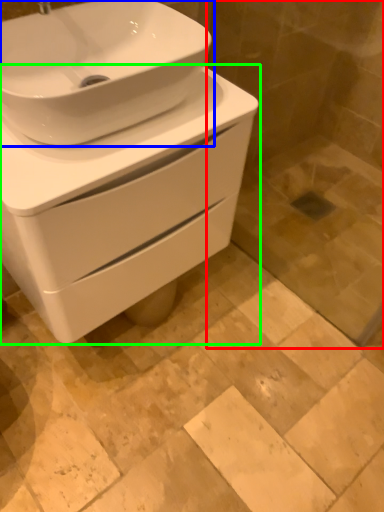
Question: Which object is the closest to the glass door (highlighted by a red box)? Choose among these: sink (highlighted by a blue box) or toilet (highlighted by a green box).

Choices:
 (A) sink
 (B) toilet

Answer: (B)